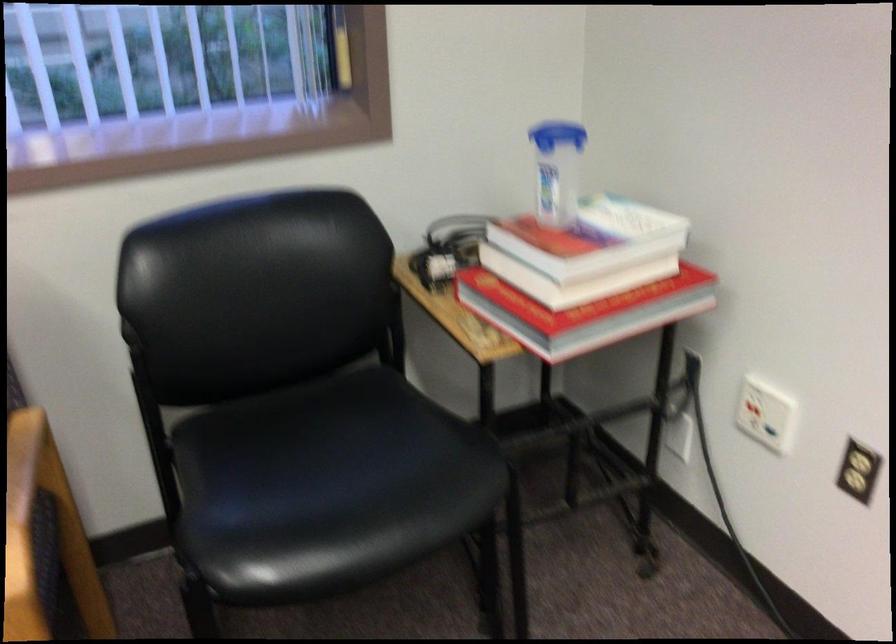
This screenshot has height=644, width=896. Find the location of `plastic water bottle`. plastic water bottle is located at coordinates (556, 169).